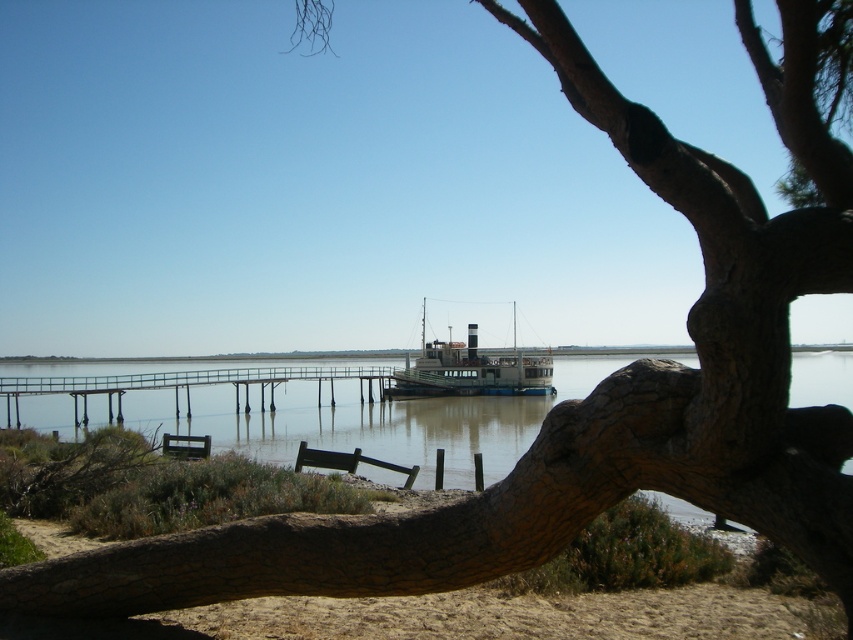
You are standing at the riverside and want to take a photo of the wooden pier at center and the greenish metallic boat at center. Which object will appear larger in the photo?

The wooden pier at center will appear larger in the photo because it is closer to the camera than the greenish metallic boat at center.

You are planning to sit on the wooden park bench at lower center to enjoy the riverside view. However, there is a greenish metallic boat at center in the scene. Will the boat block your view of the river?

The greenish metallic boat at center is positioned over the wooden park bench at lower center, so it will block your view of the river when sitting there.

Looking at this image, you are planning to take a photo of the wooden pier at center from the wooden park bench at lower left. Will the bench block your view of the pier?

The wooden pier at center is located below the wooden park bench at lower left, so standing on the bench would allow you to see the pier without obstruction.